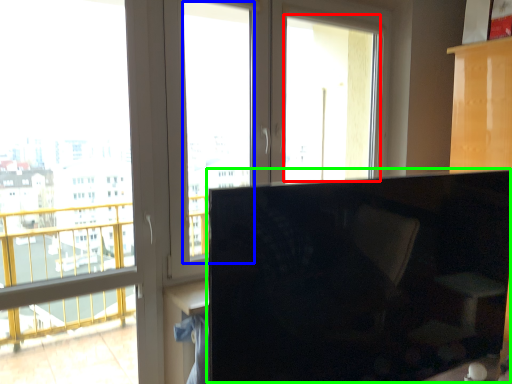
Question: Which object is positioned farthest from window screen (highlighted by a red box)? Select from window screen (highlighted by a blue box) and computer monitor (highlighted by a green box).

Choices:
 (A) window screen
 (B) computer monitor

Answer: (B)